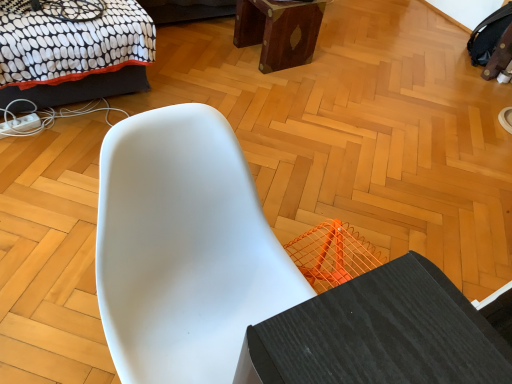
You are a GUI agent. You are given a task and a screenshot of the screen. Output one action in this format:
    pyautogui.click(x=<x>, y=<y>)
    Task: Click on the mahogany wood stool at upper center
    
    Given the screenshot: What is the action you would take?
    pyautogui.click(x=279, y=31)

Describe the element at coordinates (255, 280) in the screenshot. I see `white matte chair at center` at that location.

Where is `white matte chair at center`? white matte chair at center is located at coordinates (255, 280).

Locate an element on the screen. mahogany wood stool at upper center is located at coordinates (279, 31).

Where is `bed lying behind the white matte chair at center`? This screenshot has width=512, height=384. bed lying behind the white matte chair at center is located at coordinates pyautogui.click(x=74, y=51).

From a real-world perspective, who is located higher, white matte chair at center or black dotted fabric bed at upper left?

white matte chair at center is physically above.

Is white matte chair at center wider than black dotted fabric bed at upper left?

In fact, white matte chair at center might be narrower than black dotted fabric bed at upper left.

Is white matte chair at center located outside black dotted fabric bed at upper left?

Yes, white matte chair at center is located beyond the bounds of black dotted fabric bed at upper left.

Looking at this image, considering the relative sizes of black dotted fabric bed at upper left and mahogany wood stool at upper center in the image provided, is black dotted fabric bed at upper left taller than mahogany wood stool at upper center?

No, black dotted fabric bed at upper left is not taller than mahogany wood stool at upper center.

From a real-world perspective, which object rests below the other?

mahogany wood stool at upper center is physically lower.

Would you say black dotted fabric bed at upper left is to the left or to the right of mahogany wood stool at upper center in the picture?

From the image, it's evident that black dotted fabric bed at upper left is to the left of mahogany wood stool at upper center.

Which is in front, black dotted fabric bed at upper left or mahogany wood stool at upper center?

black dotted fabric bed at upper left is closer to the camera.

Is mahogany wood stool at upper center in front of or behind black dotted fabric bed at upper left in the image?

In the image, mahogany wood stool at upper center appears behind black dotted fabric bed at upper left.

Is mahogany wood stool at upper center turned away from black dotted fabric bed at upper left?

No, mahogany wood stool at upper center's orientation is not away from black dotted fabric bed at upper left.

Is mahogany wood stool at upper center taller or shorter than black dotted fabric bed at upper left?

Clearly, mahogany wood stool at upper center is taller compared to black dotted fabric bed at upper left.

Considering the sizes of black dotted fabric bed at upper left and white matte chair at center in the image, is black dotted fabric bed at upper left taller or shorter than white matte chair at center?

Considering their sizes, black dotted fabric bed at upper left has less height than white matte chair at center.

Identify the location of chair on the right of black dotted fabric bed at upper left. This screenshot has height=384, width=512. (255, 280).

Which is more to the left, black dotted fabric bed at upper left or white matte chair at center?

From the viewer's perspective, black dotted fabric bed at upper left appears more on the left side.

Can you confirm if black dotted fabric bed at upper left is thinner than white matte chair at center?

No, black dotted fabric bed at upper left is not thinner than white matte chair at center.

From the image's perspective, which one is positioned lower, mahogany wood stool at upper center or white matte chair at center?

white matte chair at center, from the image's perspective.

In the scene shown: Considering the relative sizes of mahogany wood stool at upper center and white matte chair at center in the image provided, is mahogany wood stool at upper center smaller than white matte chair at center?

Yes.

Looking at their sizes, would you say mahogany wood stool at upper center is wider or thinner than white matte chair at center?

mahogany wood stool at upper center is thinner than white matte chair at center.

Considering the relative sizes of mahogany wood stool at upper center and white matte chair at center in the image provided, is mahogany wood stool at upper center taller than white matte chair at center?

No.

Considering the relative positions of white matte chair at center and mahogany wood stool at upper center in the image provided, is white matte chair at center behind mahogany wood stool at upper center?

No, white matte chair at center is closer to the camera.

Can you confirm if white matte chair at center is smaller than mahogany wood stool at upper center?

Incorrect, white matte chair at center is not smaller in size than mahogany wood stool at upper center.

From the image's perspective, is white matte chair at center over mahogany wood stool at upper center?

Actually, white matte chair at center appears below mahogany wood stool at upper center in the image.

Can you confirm if white matte chair at center is wider than mahogany wood stool at upper center?

Correct, the width of white matte chair at center exceeds that of mahogany wood stool at upper center.

The height and width of the screenshot is (384, 512). I want to click on chair in front of the black dotted fabric bed at upper left, so click(255, 280).

Locate an element on the screen. furniture on the right of black dotted fabric bed at upper left is located at coordinates (279, 31).

From the image, which object appears to be nearer to mahogany wood stool at upper center, black dotted fabric bed at upper left or white matte chair at center?

Based on the image, black dotted fabric bed at upper left appears to be nearer to mahogany wood stool at upper center.

From the image, which object appears to be nearer to black dotted fabric bed at upper left, mahogany wood stool at upper center or white matte chair at center?

The object closer to black dotted fabric bed at upper left is mahogany wood stool at upper center.

Considering their positions, is black dotted fabric bed at upper left positioned further to white matte chair at center than mahogany wood stool at upper center?

The object further to white matte chair at center is mahogany wood stool at upper center.

Considering their positions, is mahogany wood stool at upper center positioned further to white matte chair at center than black dotted fabric bed at upper left?

mahogany wood stool at upper center is positioned further to the anchor white matte chair at center.

When comparing their distances from black dotted fabric bed at upper left, does white matte chair at center or mahogany wood stool at upper center seem further?

Among the two, white matte chair at center is located further to black dotted fabric bed at upper left.

Looking at the image, which one is located closer to mahogany wood stool at upper center, white matte chair at center or black dotted fabric bed at upper left?

Among the two, black dotted fabric bed at upper left is located nearer to mahogany wood stool at upper center.

This screenshot has width=512, height=384. I want to click on bed located between white matte chair at center and mahogany wood stool at upper center in the depth direction, so click(x=74, y=51).